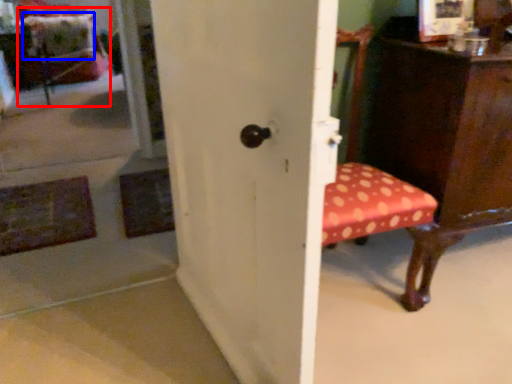
Question: Which of the following is the closest to the observer, swivel chair (highlighted by a red box) or pillow (highlighted by a blue box)?

Choices:
 (A) swivel chair
 (B) pillow

Answer: (A)